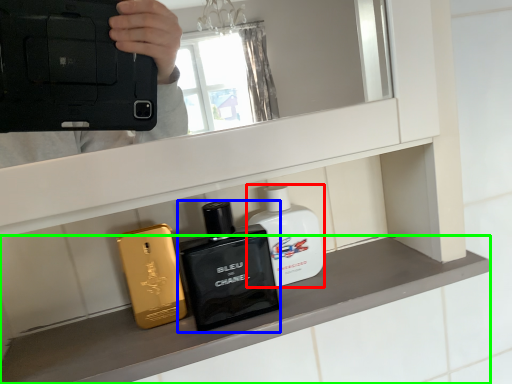
Question: Which object is the closest to the perfume (highlighted by a red box)? Choose among these: toiletry (highlighted by a blue box) or mantle (highlighted by a green box).

Choices:
 (A) toiletry
 (B) mantle

Answer: (A)